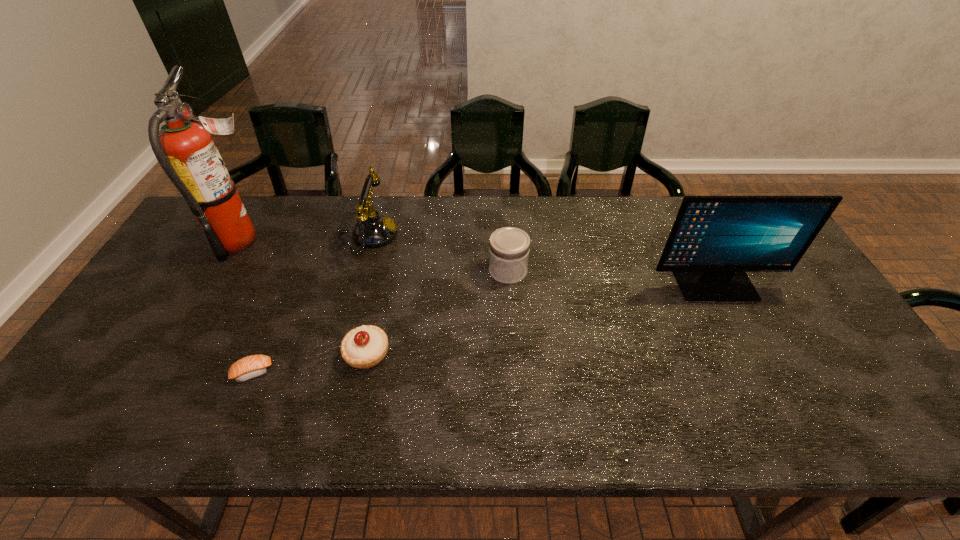
Locate an element on the screen. The height and width of the screenshot is (540, 960). object that is at the far left corner is located at coordinates (184, 148).

The height and width of the screenshot is (540, 960). What are the coordinates of `blank space at the far edge of the desktop` in the screenshot? It's located at (310, 225).

Identify the location of blank area at the near edge. (217, 427).

The height and width of the screenshot is (540, 960). Find the location of `vacant region at the left edge of the desktop`. vacant region at the left edge of the desktop is located at coordinates (179, 265).

Where is `free space at the right edge of the desktop`? This screenshot has height=540, width=960. free space at the right edge of the desktop is located at coordinates (787, 330).

I want to click on unoccupied area between the telephone and the leftmost object, so click(x=305, y=238).

The width and height of the screenshot is (960, 540). Identify the location of vacant area that lies between the monitor and the fourth tallest object. (612, 278).

Where is `free space between the shortest object and the second shortest object`? free space between the shortest object and the second shortest object is located at coordinates (310, 363).

The image size is (960, 540). I want to click on unoccupied position between the jar and the pastry, so click(x=438, y=312).

Locate an element on the screen. vacant space in between the second tallest object and the pastry is located at coordinates (541, 319).